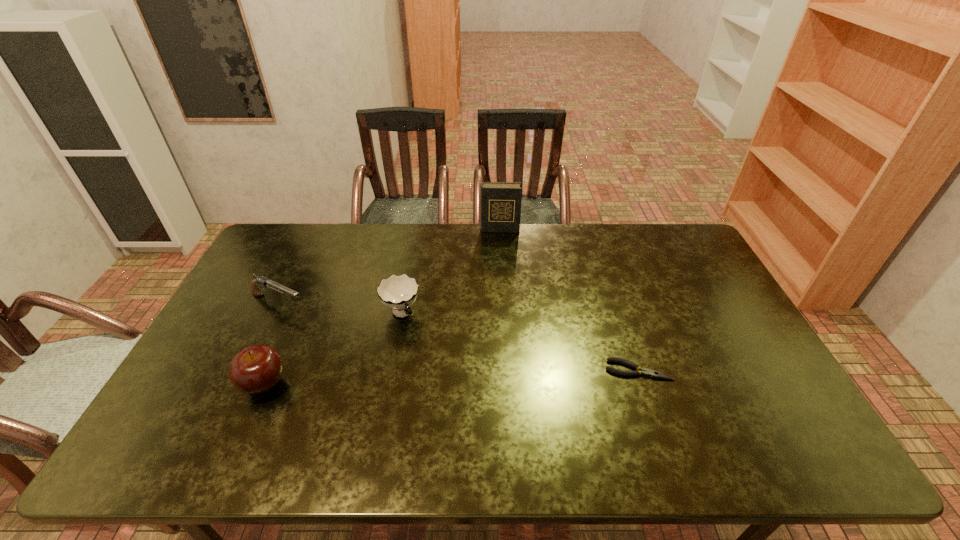
Locate an element on the screen. vacant point located between the apple and the rightmost object is located at coordinates (451, 377).

Point out which object is positioned as the nearest to the cup. Please provide its 2D coordinates. Your answer should be formatted as a tuple, i.e. [(x, y)], where the tuple contains the x and y coordinates of a point satisfying the conditions above.

[(262, 282)]

Identify the location of object that is the closest one to the cup. This screenshot has height=540, width=960. (262, 282).

Find the location of a particular element. Image resolution: width=960 pixels, height=540 pixels. vacant region that satisfies the following two spatial constraints: 1. on the back side of the gun; 2. on the left side of the farthest object is located at coordinates (315, 230).

You are a GUI agent. You are given a task and a screenshot of the screen. Output one action in this format:
    pyautogui.click(x=<x>, y=<y>)
    Task: Click on the vacant region that satisfies the following two spatial constraints: 1. on the front side of the gun; 2. on the left side of the second tallest object
    The height and width of the screenshot is (540, 960).
    Given the screenshot: What is the action you would take?
    pyautogui.click(x=239, y=384)